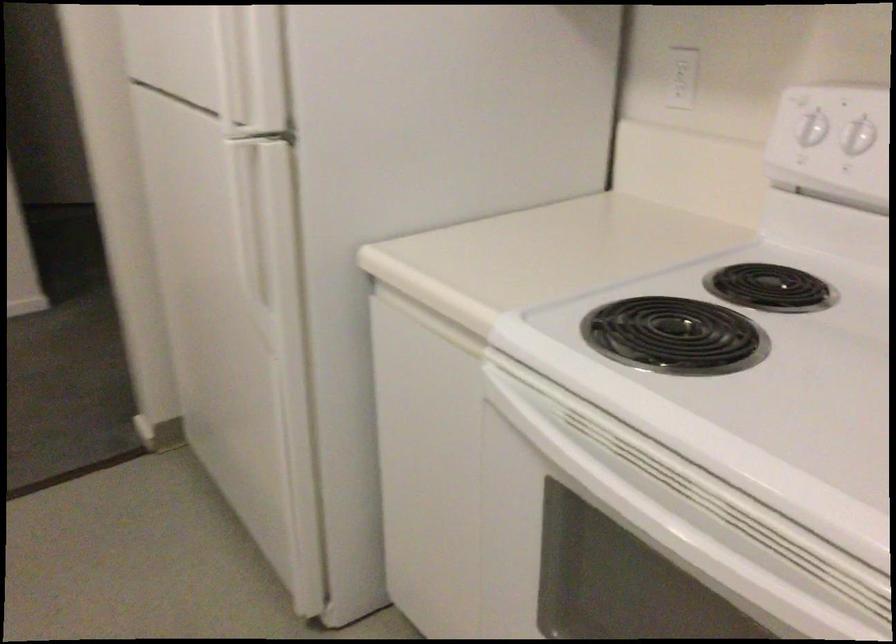
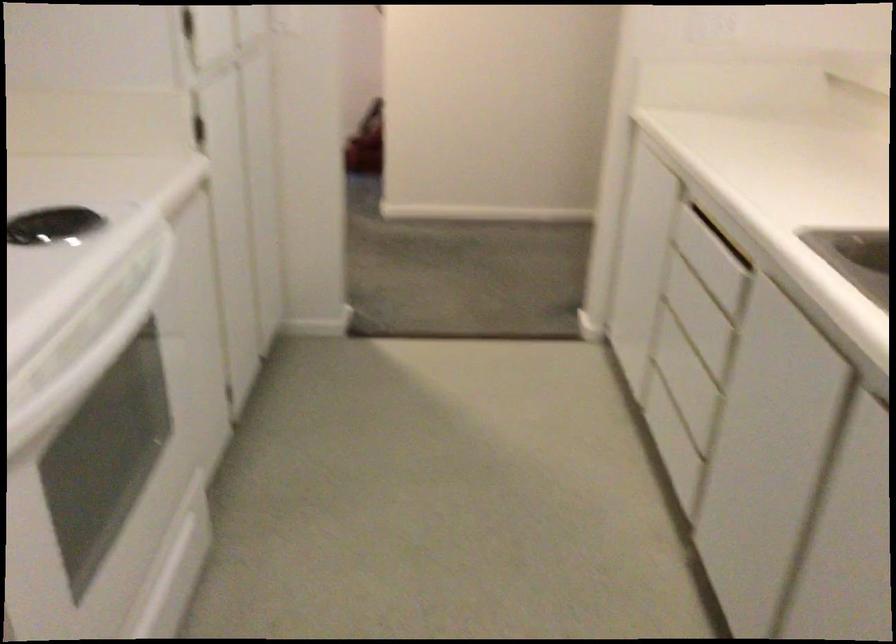
Find the pixel in the second image that matches the point at 624,478 in the first image.

(89, 359)